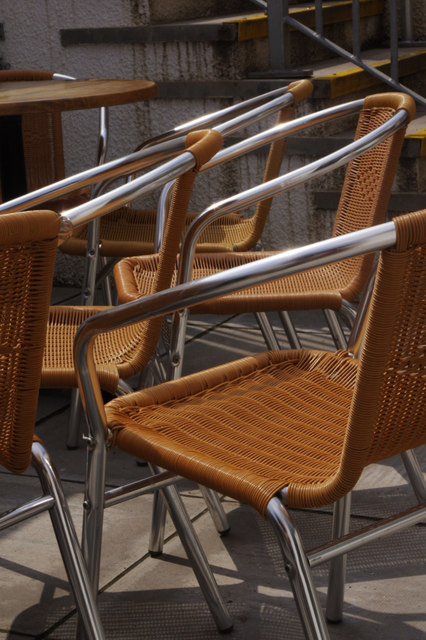
Identify the location of places to sit on. Image resolution: width=426 pixels, height=640 pixels. (296, 397), (51, 342), (212, 269), (214, 233).